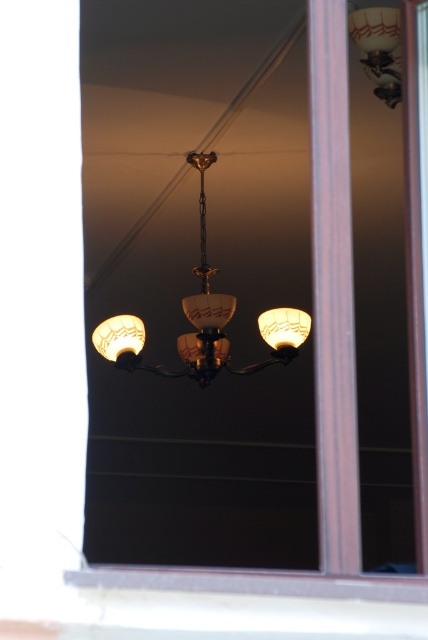
You are an interior designer assessing the lighting in the room. You need to determine if the translucent glass lampshade at right can be placed on the matte glass chandelier at center. Based on their sizes, is this possible?

The matte glass chandelier at center is larger in size than the translucent glass lampshade at right, so it is possible to place the translucent glass lampshade at right on the matte glass chandelier at center since it is smaller in size.

You are standing in the room and want to place a new painting on the wall. The painting is 1 meter wide and needs to be centered between the matte glass chandelier at center and the matte glass lampshade at center. Can you fit the painting between them?

The matte glass chandelier at center is positioned on the right side of the matte glass lampshade at center, so the distance between them must be at least 1 meter to accommodate the painting. However, the exact spacing isn